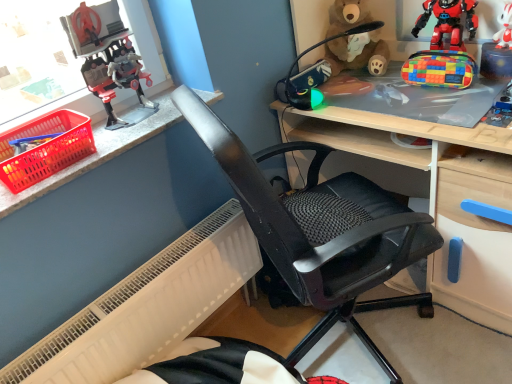
Locate an element on the screen. This screenshot has width=512, height=384. empty space that is ontop of white plastic radiator at lower left (from a real-world perspective) is located at coordinates (150, 269).